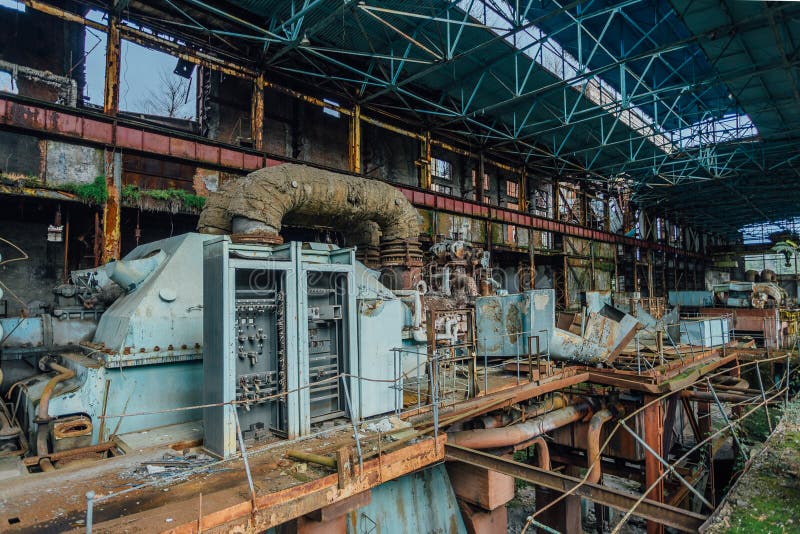
Where is `ceiling`? ceiling is located at coordinates (762, 65).